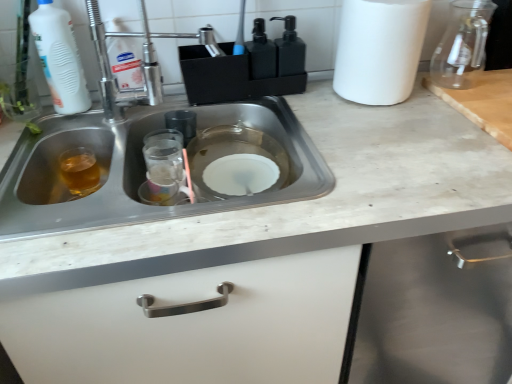
Question: Does transparent glass jar at upper right lie behind white matte paper towel at upper right?

Choices:
 (A) no
 (B) yes

Answer: (B)

Question: From the image's perspective, is transparent glass jar at upper right above white matte paper towel at upper right?

Choices:
 (A) yes
 (B) no

Answer: (A)

Question: From a real-world perspective, is transparent glass jar at upper right on white matte paper towel at upper right?

Choices:
 (A) no
 (B) yes

Answer: (B)

Question: Is transparent glass jar at upper right thinner than white matte paper towel at upper right?

Choices:
 (A) no
 (B) yes

Answer: (B)

Question: Is transparent glass jar at upper right to the right of white matte paper towel at upper right from the viewer's perspective?

Choices:
 (A) no
 (B) yes

Answer: (B)

Question: Is transparent glass jar at upper right bigger or smaller than stainless steel sink at center?

Choices:
 (A) small
 (B) big

Answer: (A)

Question: From the image's perspective, is transparent glass jar at upper right positioned above or below stainless steel sink at center?

Choices:
 (A) below
 (B) above

Answer: (B)

Question: In terms of height, does transparent glass jar at upper right look taller or shorter compared to stainless steel sink at center?

Choices:
 (A) short
 (B) tall

Answer: (A)

Question: Choose the correct answer: Is transparent glass jar at upper right inside stainless steel sink at center or outside it?

Choices:
 (A) inside
 (B) outside

Answer: (B)

Question: Considering the positions of transparent glass jar at upper right and white matte bottle at upper left in the image, is transparent glass jar at upper right wider or thinner than white matte bottle at upper left?

Choices:
 (A) wide
 (B) thin

Answer: (A)

Question: From the image's perspective, is transparent glass jar at upper right positioned above or below white matte bottle at upper left?

Choices:
 (A) above
 (B) below

Answer: (A)

Question: Is point (453, 18) closer or farther from the camera than point (81, 110)?

Choices:
 (A) farther
 (B) closer

Answer: (A)

Question: Would you say transparent glass jar at upper right is to the left or to the right of white matte bottle at upper left in the picture?

Choices:
 (A) left
 (B) right

Answer: (B)

Question: Considering their positions, is transparent glass jar at upper right located in front of or behind black matte soap dispenser at upper center?

Choices:
 (A) behind
 (B) front

Answer: (B)

Question: Considering the relative positions of transparent glass jar at upper right and black matte soap dispenser at upper center in the image provided, is transparent glass jar at upper right to the left or to the right of black matte soap dispenser at upper center?

Choices:
 (A) left
 (B) right

Answer: (B)